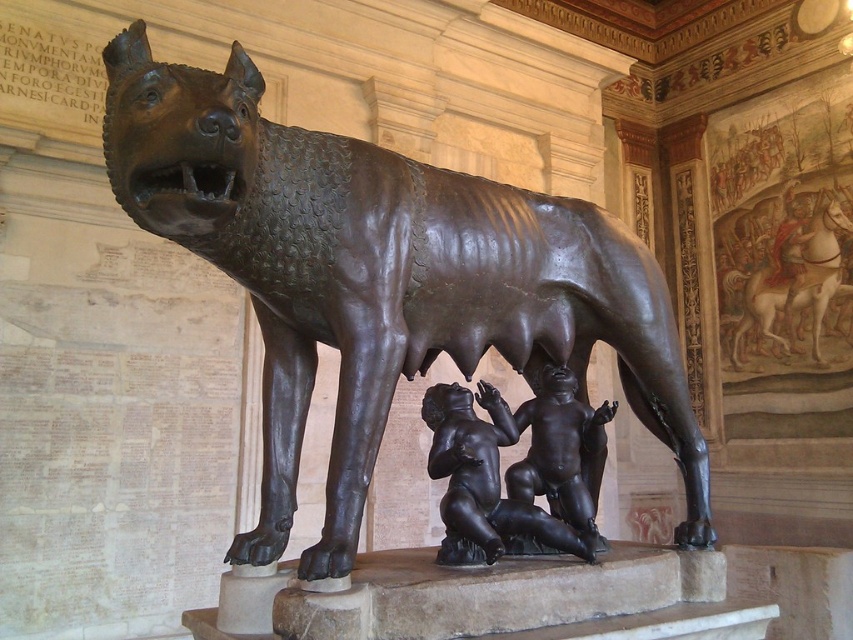
Can you confirm if bronze textured wolf at center is positioned to the left of bronze horse at upper right?

Yes, bronze textured wolf at center is to the left of bronze horse at upper right.

This screenshot has width=853, height=640. I want to click on bronze textured wolf at center, so click(381, 278).

Is point (434, 204) closer to viewer compared to point (816, 269)?

Yes.

Where is `bronze textured wolf at center`? This screenshot has width=853, height=640. bronze textured wolf at center is located at coordinates (381, 278).

Is bronze textured wolf at center to the left of polished bronze twin figures at center from the viewer's perspective?

Yes, bronze textured wolf at center is to the left of polished bronze twin figures at center.

Is bronze textured wolf at center positioned before polished bronze twin figures at center?

Yes.

The width and height of the screenshot is (853, 640). In order to click on bronze textured wolf at center in this screenshot , I will do coord(381,278).

Between polished bronze twin figures at center and bronze horse at upper right, which one is positioned lower?

polished bronze twin figures at center is lower down.

Who is more distant from viewer, (450,493) or (790,324)?

Point (790,324)

Find the location of a particular element. The height and width of the screenshot is (640, 853). polished bronze twin figures at center is located at coordinates (483, 481).